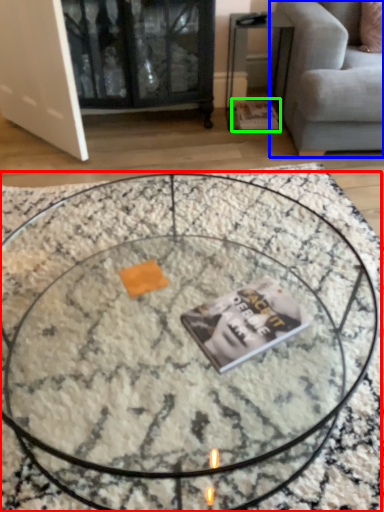
Question: Which is nearer to the coffee table (highlighted by a red box)? studio couch (highlighted by a blue box) or magazine (highlighted by a green box).

Choices:
 (A) studio couch
 (B) magazine

Answer: (A)